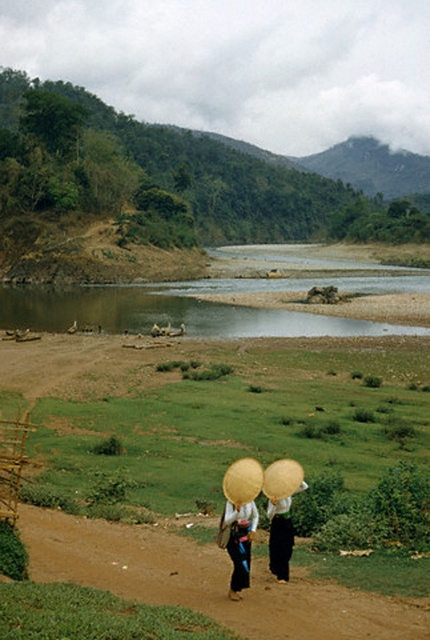
Question: Which object is closer to the camera taking this photo?

Choices:
 (A) brown sedimentary river at center
 (B) brown dirt path at lower center
 (C) wooden woven basket at lower left

Answer: (B)

Question: Does brown dirt path at lower center appear over wooden woven basket at lower left?

Choices:
 (A) yes
 (B) no

Answer: (B)

Question: Which object is positioned closest to the brown dirt path at lower center?

Choices:
 (A) wooden woven basket at lower left
 (B) brown sedimentary river at center

Answer: (A)

Question: Which of the following is the farthest from the observer?

Choices:
 (A) (8, 497)
 (B) (43, 314)

Answer: (B)

Question: Observing the image, what is the correct spatial positioning of brown dirt path at lower center in reference to brown sedimentary river at center?

Choices:
 (A) above
 (B) below

Answer: (B)

Question: Is brown dirt path at lower center positioned in front of brown sedimentary river at center?

Choices:
 (A) yes
 (B) no

Answer: (A)